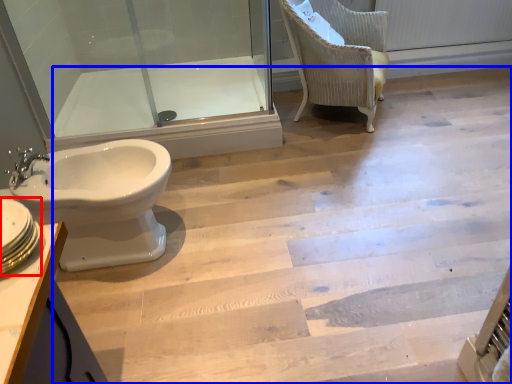
Question: Which of the following is the closest to the observer, sink (highlighted by a red box) or stairwell (highlighted by a blue box)?

Choices:
 (A) sink
 (B) stairwell

Answer: (A)